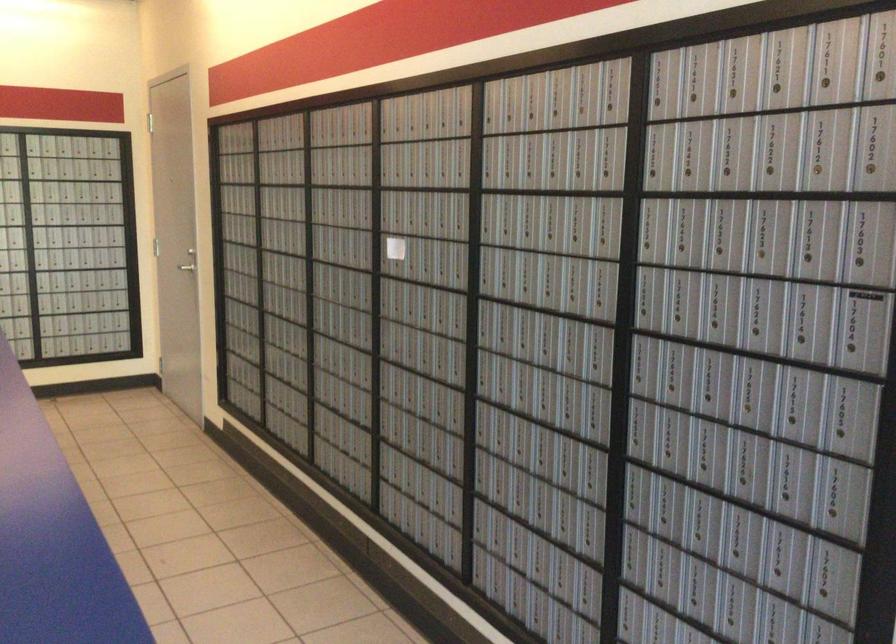
You are a GUI agent. You are given a task and a screenshot of the screen. Output one action in this format:
    pyautogui.click(x=<x>, y=<y>)
    Task: Click on the mailbox keyhole
    The width and height of the screenshot is (896, 644).
    Given the screenshot: What is the action you would take?
    pos(394,248)